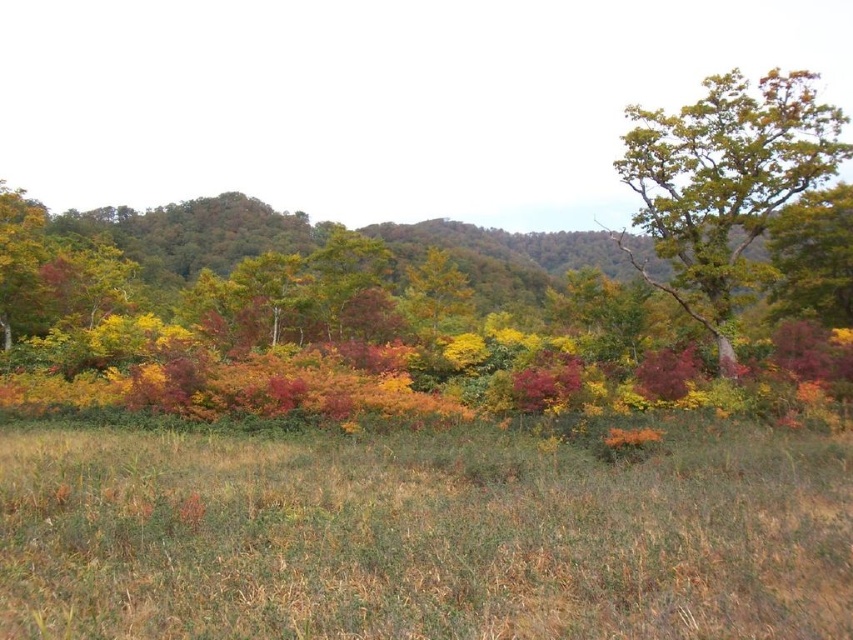
Question: Which of the following is the closest to the observer?

Choices:
 (A) (718, 362)
 (B) (148, 525)

Answer: (B)

Question: Does brown dry grass at center appear on the left side of green leafy tree at upper right?

Choices:
 (A) yes
 (B) no

Answer: (A)

Question: Is the position of brown dry grass at center more distant than that of green leafy tree at upper right?

Choices:
 (A) yes
 (B) no

Answer: (B)

Question: Among these objects, which one is farthest from the camera?

Choices:
 (A) brown dry grass at center
 (B) green leafy tree at upper right

Answer: (B)

Question: Can you confirm if brown dry grass at center is thinner than green leafy tree at upper right?

Choices:
 (A) no
 (B) yes

Answer: (B)